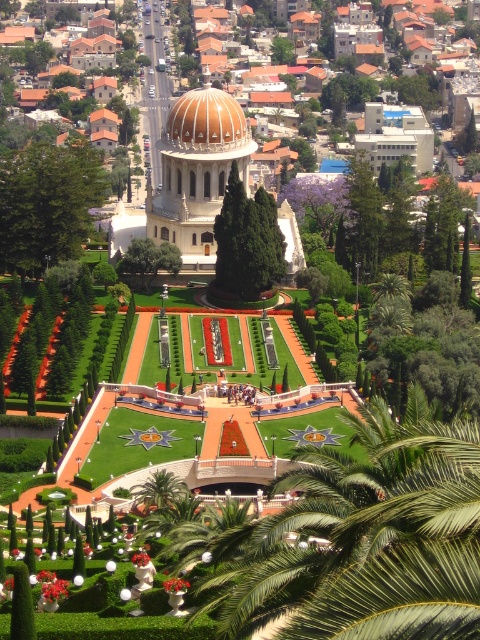
Is point (474, 611) farther from viewer compared to point (157, 502)?

No, it is in front of (157, 502).

Can you confirm if green leafy palm tree at center is positioned to the right of green leafy palm tree at lower center?

Yes, green leafy palm tree at center is to the right of green leafy palm tree at lower center.

Locate an element on the screen. green leafy palm tree at center is located at coordinates (367, 538).

At what (x,y) coordinates should I click in order to perform the action: click on green leafy palm tree at center. Please return your answer as a coordinate pair (x, y). The width and height of the screenshot is (480, 640). Looking at the image, I should click on (367, 538).

Can you confirm if matte gold dome at center is shorter than green leafy palm tree at lower center?

In fact, matte gold dome at center may be taller than green leafy palm tree at lower center.

Consider the image. Which of these two, matte gold dome at center or green leafy palm tree at lower center, stands shorter?

green leafy palm tree at lower center is shorter.

Between point (187, 148) and point (159, 486), which one is positioned in front?

Point (159, 486)

Where is `matte gold dome at center`? The image size is (480, 640). matte gold dome at center is located at coordinates (205, 122).

Between green leafy palm tree at center and matte gold dome at center, which one is positioned lower?

Positioned lower is green leafy palm tree at center.

Does point (252, 538) come in front of point (182, 140)?

Yes, point (252, 538) is in front of point (182, 140).

Is point (316, 522) positioned behind point (180, 145)?

No, it is not.

At what (x,y) coordinates should I click in order to perform the action: click on green leafy palm tree at center. Please return your answer as a coordinate pair (x, y). The height and width of the screenshot is (640, 480). Looking at the image, I should click on (367, 538).